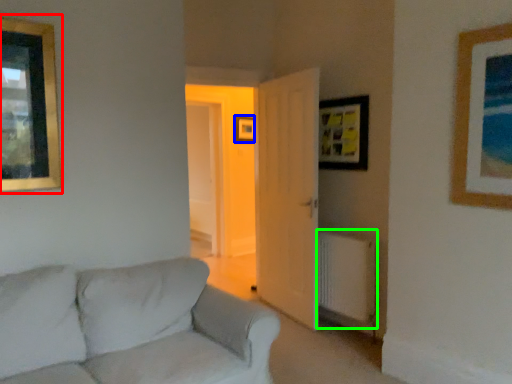
Question: Which object is the farthest from picture frame (highlighted by a red box)? Choose among these: picture frame (highlighted by a blue box) or radiator (highlighted by a green box).

Choices:
 (A) picture frame
 (B) radiator

Answer: (A)